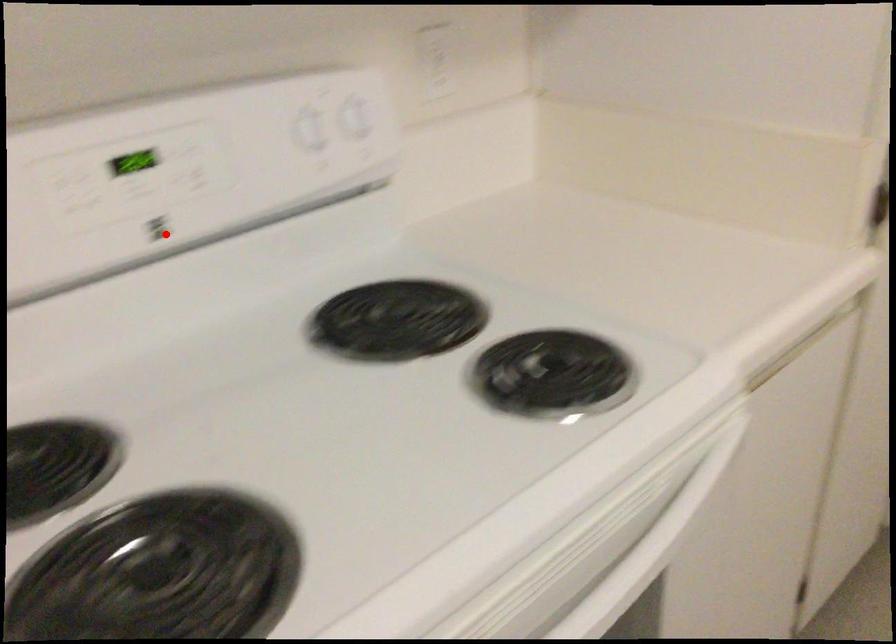
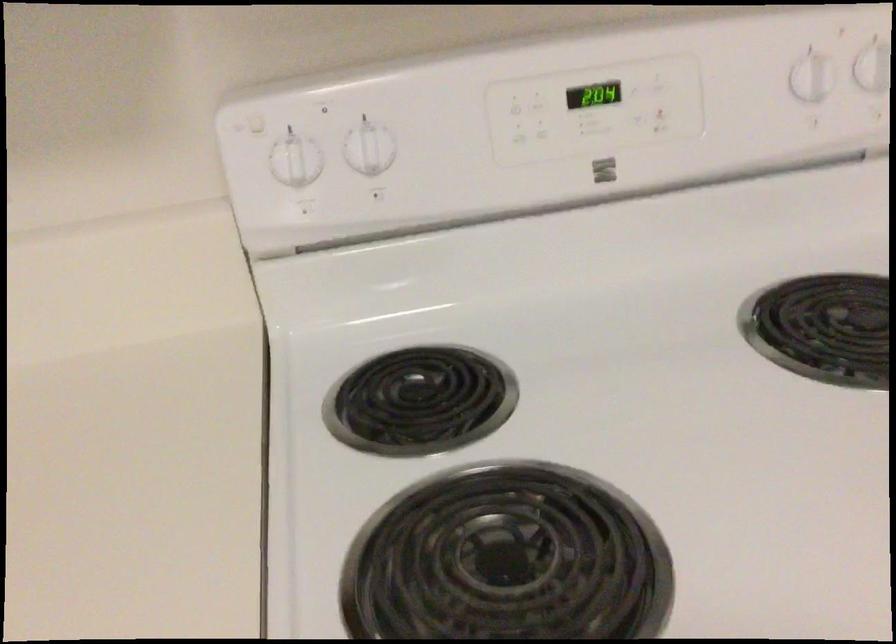
Question: I am providing you with two images of the same scene from different viewpoints. In image1, a red point is highlighted. Considering the same 3D point in image2, which of the following is correct?

Choices:
 (A) It is closer
 (B) It is farther

Answer: (A)